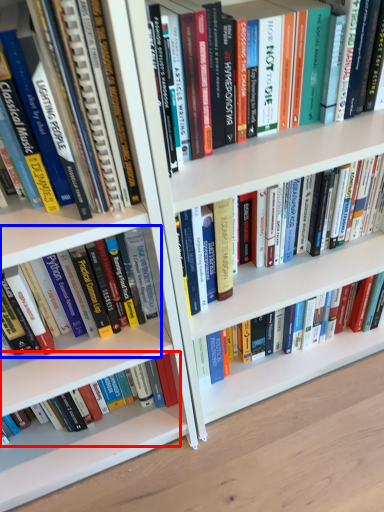
Question: Which object appears farthest to the camera in this image, book (highlighted by a red box) or book (highlighted by a blue box)?

Choices:
 (A) book
 (B) book

Answer: (A)